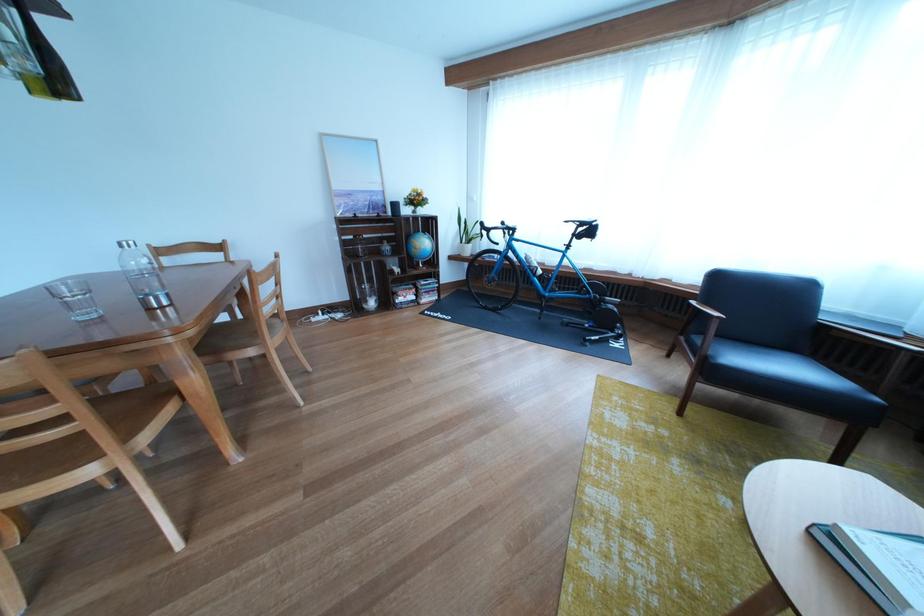
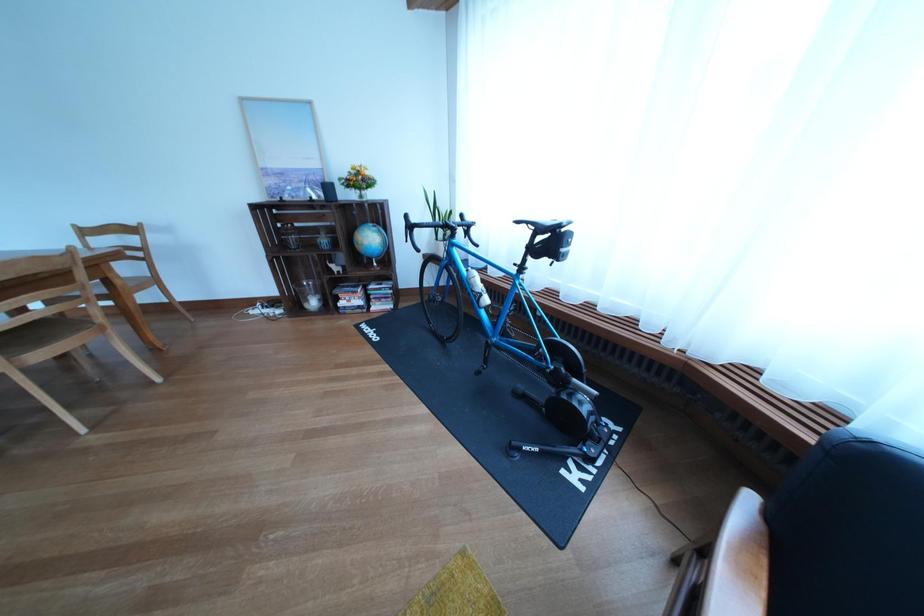
Find the pixel in the second image that matches pixel 363 200 in the first image.

(294, 179)